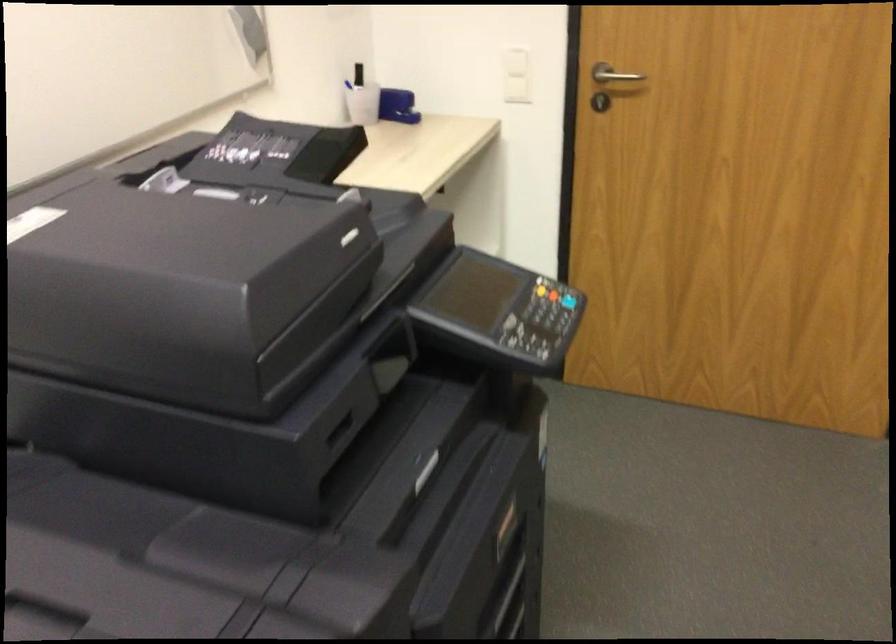
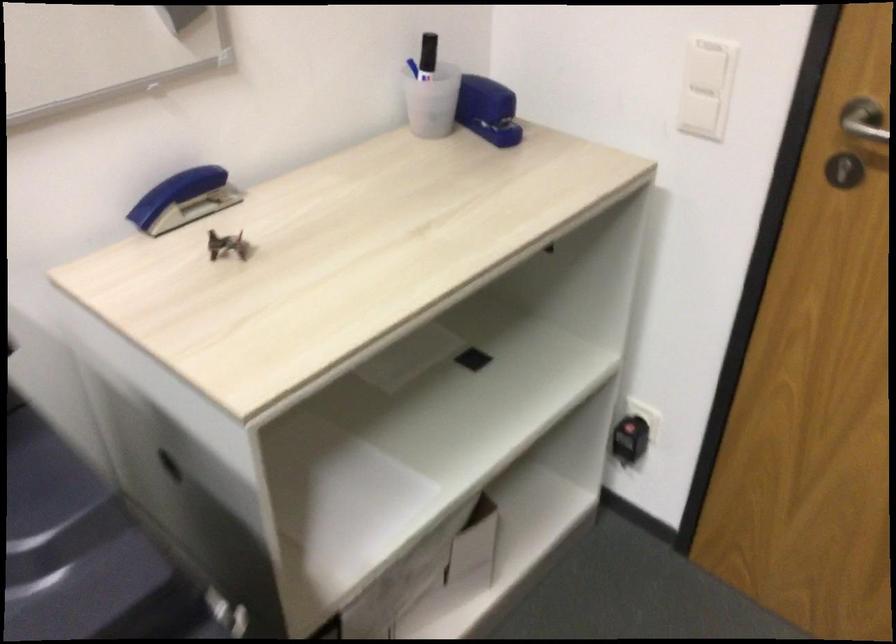
In the second image, find the point that corresponds to (x=367, y=100) in the first image.

(428, 102)